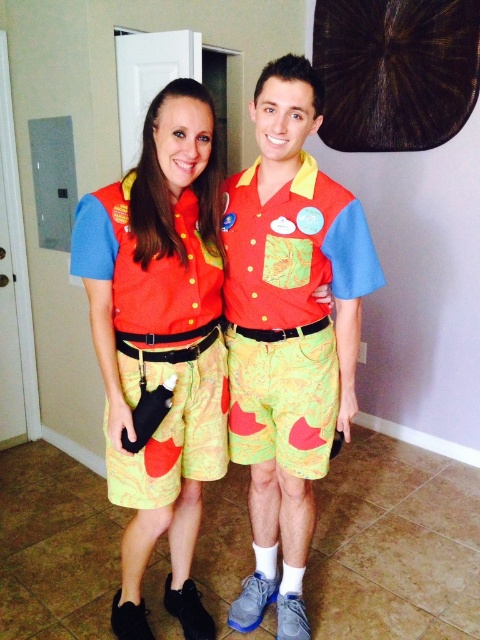
Between matte polyester vest at center and matte fabric shirt at center, which one appears on the right side from the viewer's perspective?

Positioned to the right is matte fabric shirt at center.

Does matte polyester vest at center have a greater width compared to matte fabric shirt at center?

In fact, matte polyester vest at center might be narrower than matte fabric shirt at center.

What are the coordinates of `matte polyester vest at center` in the screenshot? It's located at (160, 340).

The width and height of the screenshot is (480, 640). Find the location of `matte polyester vest at center`. matte polyester vest at center is located at coordinates (160, 340).

Is matte polyester shorts at center to the left of matte fabric shirt at center from the viewer's perspective?

Correct, you'll find matte polyester shorts at center to the left of matte fabric shirt at center.

Who is positioned more to the right, matte polyester shorts at center or matte fabric shirt at center?

matte fabric shirt at center

The width and height of the screenshot is (480, 640). In order to click on matte polyester shorts at center in this screenshot , I will do pos(228,336).

Can you confirm if matte polyester shorts at center is bigger than matte polyester vest at center?

Yes, matte polyester shorts at center is bigger than matte polyester vest at center.

Does matte polyester shorts at center appear on the left side of matte polyester vest at center?

In fact, matte polyester shorts at center is to the right of matte polyester vest at center.

Where is `matte polyester shorts at center`? This screenshot has width=480, height=640. matte polyester shorts at center is located at coordinates (228, 336).